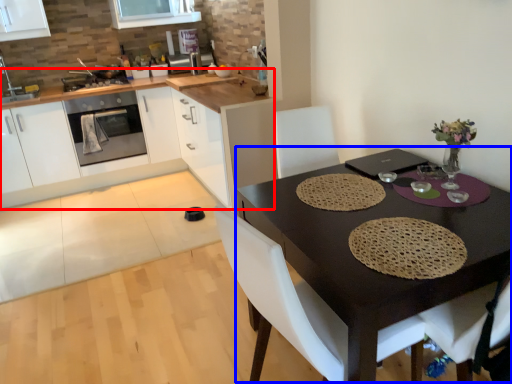
Question: Which of the following is the closest to the observer, countertop (highlighted by a red box) or round table (highlighted by a blue box)?

Choices:
 (A) countertop
 (B) round table

Answer: (B)